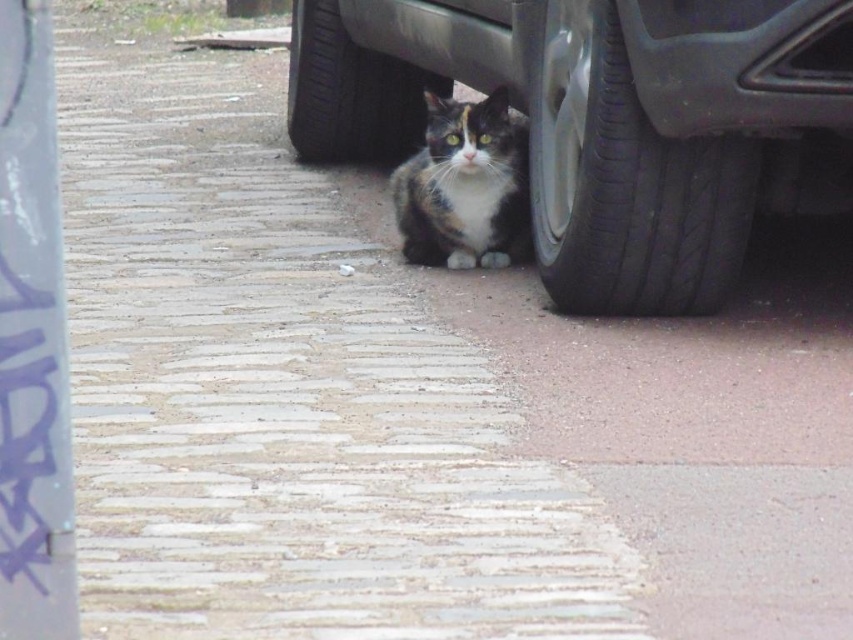
Question: Is black rubber tire at lower right to the right of calico fur cat at center from the viewer's perspective?

Choices:
 (A) no
 (B) yes

Answer: (B)

Question: Does metallic gray car at lower center have a greater width compared to black rubber tire at lower right?

Choices:
 (A) yes
 (B) no

Answer: (A)

Question: Does metallic gray car at lower center have a greater width compared to black rubber tire at lower center?

Choices:
 (A) no
 (B) yes

Answer: (B)

Question: Which of the following is the closest to the observer?

Choices:
 (A) calico fur cat at center
 (B) black rubber tire at lower right
 (C) black rubber tire at lower center

Answer: (B)

Question: Which point is farther to the camera?

Choices:
 (A) (515, 168)
 (B) (636, 308)
 (C) (688, 253)

Answer: (A)

Question: Estimate the real-world distances between objects in this image. Which object is closer to the black rubber tire at lower center?

Choices:
 (A) metallic gray car at lower center
 (B) calico fur cat at center

Answer: (A)